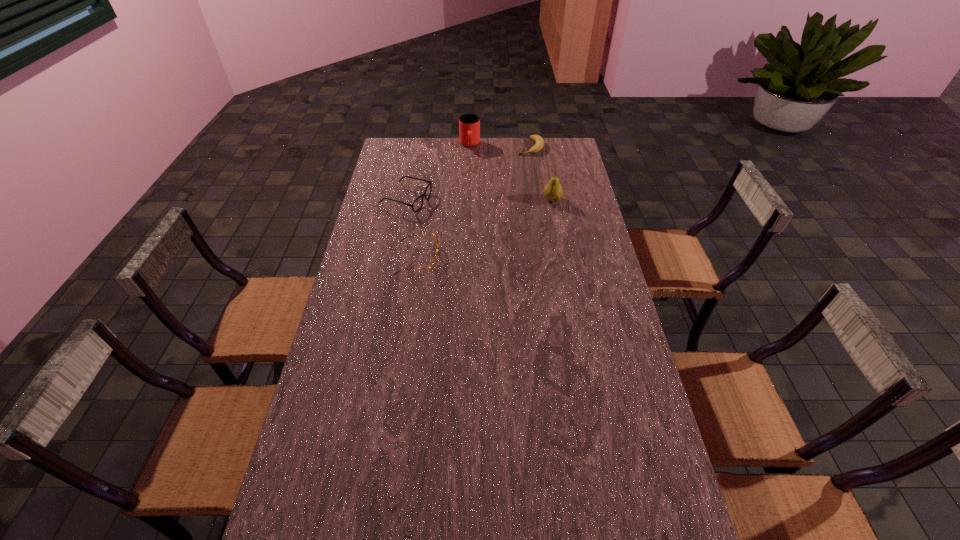
Find the location of a particular element. This screenshot has height=540, width=960. the nearest object is located at coordinates (434, 263).

Find the location of a particular element. pear is located at coordinates (553, 191).

The width and height of the screenshot is (960, 540). What are the coordinates of `the farther spectacles` in the screenshot? It's located at (418, 203).

Where is `cup`? cup is located at coordinates (469, 124).

At what (x,y) coordinates should I click in order to perform the action: click on the shortest object. Please return your answer as a coordinate pair (x, y). Image resolution: width=960 pixels, height=540 pixels. Looking at the image, I should click on (538, 146).

The width and height of the screenshot is (960, 540). I want to click on free point located 0.150m on the front-facing side of the nearest object, so click(481, 259).

Identify the location of free region located 0.190m on the left of the pear. This screenshot has width=960, height=540. tap(496, 200).

At what (x,y) coordinates should I click in order to perform the action: click on blank space located 0.280m on the front-facing side of the farther spectacles. Please return your answer as a coordinate pair (x, y). Looking at the image, I should click on (493, 222).

Locate an element on the screen. The image size is (960, 540). free space located 0.140m on the front-facing side of the farther spectacles is located at coordinates (461, 213).

Where is `vacant space located 0.240m on the front-facing side of the farther spectacles`? vacant space located 0.240m on the front-facing side of the farther spectacles is located at coordinates (484, 219).